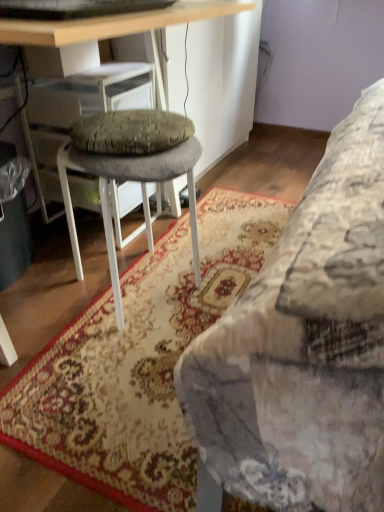
Question: Is wooden desk at center positioned before floral carpet at lower right?

Choices:
 (A) no
 (B) yes

Answer: (B)

Question: Is wooden desk at center not inside floral carpet at lower right?

Choices:
 (A) yes
 (B) no

Answer: (A)

Question: Considering the relative sizes of wooden desk at center and floral carpet at lower right in the image provided, is wooden desk at center shorter than floral carpet at lower right?

Choices:
 (A) yes
 (B) no

Answer: (B)

Question: Is wooden desk at center at the left side of floral carpet at lower right?

Choices:
 (A) no
 (B) yes

Answer: (B)

Question: Is there a large distance between wooden desk at center and floral carpet at lower right?

Choices:
 (A) no
 (B) yes

Answer: (A)

Question: Does wooden desk at center have a lesser width compared to floral carpet at lower right?

Choices:
 (A) no
 (B) yes

Answer: (A)

Question: Considering the relative positions of wooden desk at center and gray fabric stool at center in the image provided, is wooden desk at center to the right of gray fabric stool at center from the viewer's perspective?

Choices:
 (A) no
 (B) yes

Answer: (A)

Question: From a real-world perspective, is wooden desk at center physically above gray fabric stool at center?

Choices:
 (A) yes
 (B) no

Answer: (A)

Question: Is wooden desk at center closer to the viewer compared to gray fabric stool at center?

Choices:
 (A) yes
 (B) no

Answer: (A)

Question: Does wooden desk at center have a greater width compared to gray fabric stool at center?

Choices:
 (A) no
 (B) yes

Answer: (B)

Question: Is wooden desk at center completely or partially outside of gray fabric stool at center?

Choices:
 (A) no
 (B) yes

Answer: (B)

Question: From the image's perspective, is wooden desk at center located above gray fabric stool at center?

Choices:
 (A) yes
 (B) no

Answer: (A)

Question: Could you tell me if floral carpet at lower right is turned towards wooden desk at center?

Choices:
 (A) yes
 (B) no

Answer: (B)